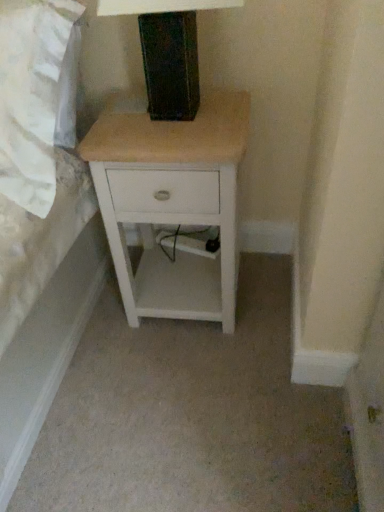
I want to click on free point above white wood nightstand at center (from a real-world perspective), so click(180, 118).